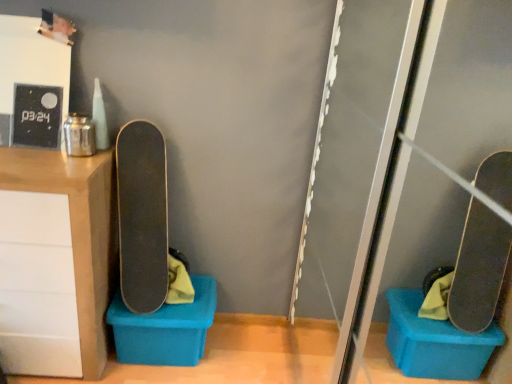
This screenshot has width=512, height=384. Find the location of `vacant region above blue plastic storage box at lower left (from a real-world perspective)`. vacant region above blue plastic storage box at lower left (from a real-world perspective) is located at coordinates (176, 302).